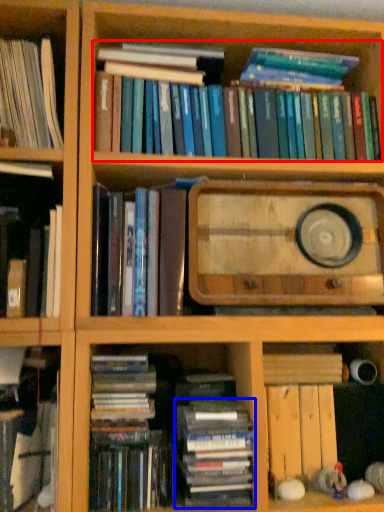
Question: Among these objects, which one is farthest to the camera, book (highlighted by a red box) or book (highlighted by a blue box)?

Choices:
 (A) book
 (B) book

Answer: (A)